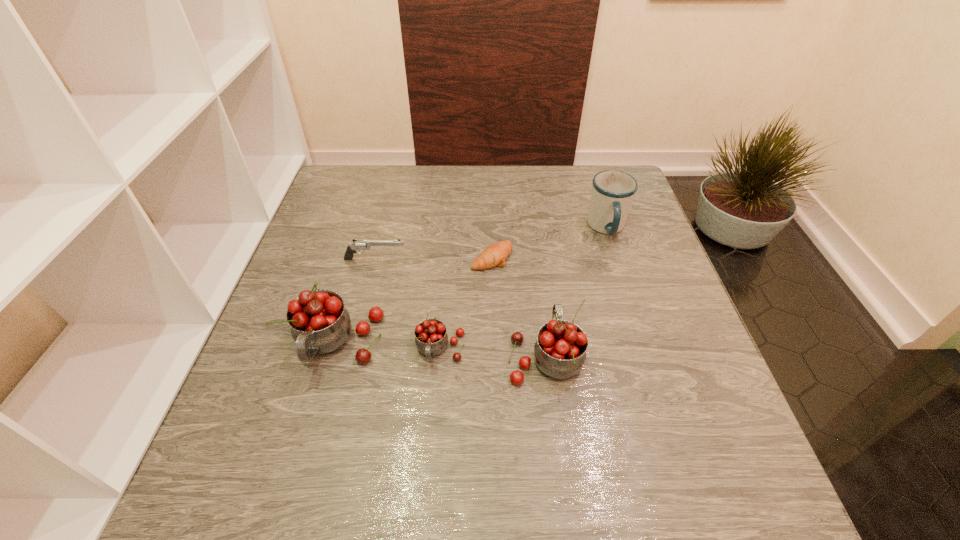
Locate an element on the screen. The image size is (960, 540). the leftmost cherry is located at coordinates (320, 324).

The image size is (960, 540). What are the coordinates of `the shortest cherry` in the screenshot? It's located at (431, 338).

Where is `the fourth tallest object`? This screenshot has height=540, width=960. the fourth tallest object is located at coordinates (431, 338).

The height and width of the screenshot is (540, 960). What are the coordinates of `the second tallest cherry` in the screenshot? It's located at (560, 350).

This screenshot has height=540, width=960. In order to click on the shortest object in this screenshot , I will do `click(494, 255)`.

Locate an element on the screen. The image size is (960, 540). the rightmost object is located at coordinates (613, 191).

At what (x,y) coordinates should I click in order to perform the action: click on pistol. Please return your answer as a coordinate pair (x, y). The height and width of the screenshot is (540, 960). Looking at the image, I should click on (359, 245).

Where is `free space located on the handle side of the leftmost cherry`? free space located on the handle side of the leftmost cherry is located at coordinates (318, 414).

I want to click on vacant point located 0.140m on the handle side of the fourth tallest object, so click(433, 439).

At what (x,y) coordinates should I click in order to perform the action: click on vacant space located on the handle side of the rightmost cherry. Please return your answer as a coordinate pair (x, y). Looking at the image, I should click on (533, 260).